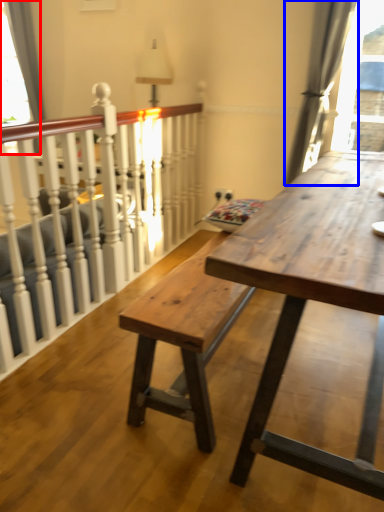
Question: Which point is closer to the camera, window (highlighted by a red box) or curtain (highlighted by a blue box)?

Choices:
 (A) window
 (B) curtain

Answer: (B)